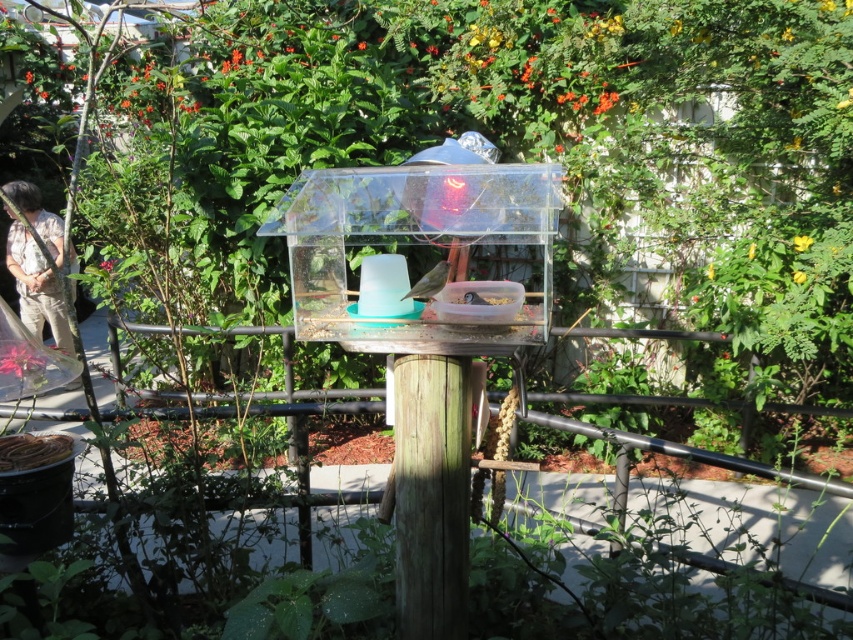
Question: Considering the relative positions of matte khaki pants at left and smooth gray bird at center in the image provided, where is matte khaki pants at left located with respect to smooth gray bird at center?

Choices:
 (A) right
 (B) left

Answer: (B)

Question: Estimate the real-world distances between objects in this image. Which object is closer to the transparent plastic bird feeder at center?

Choices:
 (A) brown matte bird at center
 (B) smooth gray bird at center
 (C) matte khaki pants at left

Answer: (A)

Question: Considering the real-world distances, which object is closest to the weathered wood pole at center?

Choices:
 (A) brown matte bird at center
 (B) matte khaki pants at left

Answer: (A)

Question: Which of the following is the farthest from the observer?

Choices:
 (A) smooth gray bird at center
 (B) weathered wood pole at center
 (C) brown matte bird at center
 (D) transparent plastic bird feeder at center

Answer: (B)

Question: Is matte khaki pants at left to the left of smooth gray bird at center from the viewer's perspective?

Choices:
 (A) yes
 (B) no

Answer: (A)

Question: Is brown matte bird at center above smooth gray bird at center?

Choices:
 (A) yes
 (B) no

Answer: (A)